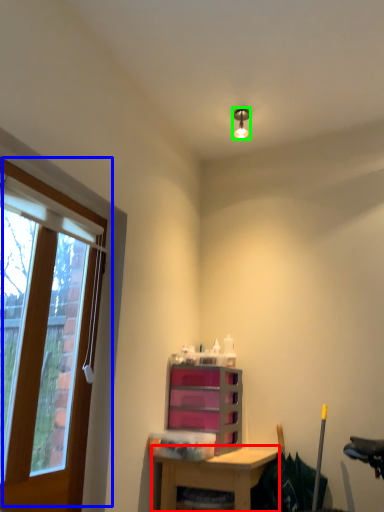
Question: Which object is positioned closest to desk (highlighted by a red box)? Select from window (highlighted by a blue box) and light fixture (highlighted by a green box).

Choices:
 (A) window
 (B) light fixture

Answer: (A)